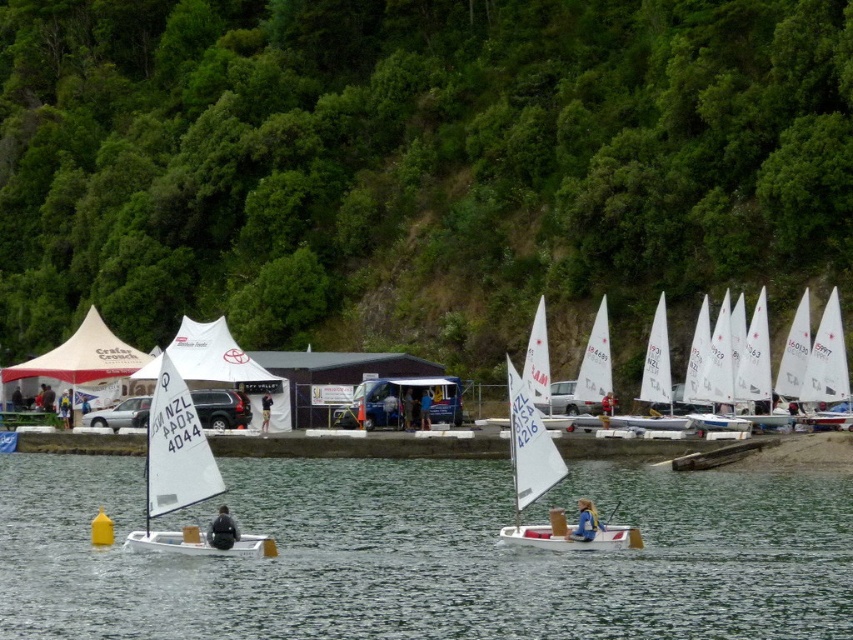
Question: Which object appears closest to the camera in this image?

Choices:
 (A) white sailboat at center
 (B) white matte sailboat at left

Answer: (A)

Question: Does black fabric jacket at lower center appear over dark blue fabric shirt at center?

Choices:
 (A) no
 (B) yes

Answer: (A)

Question: Is the position of green leafy hillside at upper center less distant than that of dark blue fabric shirt at center?

Choices:
 (A) no
 (B) yes

Answer: (B)

Question: Considering the real-world distances, which object is closest to the white sailboat at center?

Choices:
 (A) white matte sailboat at left
 (B) white matte sailboat at center

Answer: (B)

Question: Based on their relative distances, which object is farther from the black fabric jacket at lower center?

Choices:
 (A) white matte sailboat at left
 (B) white matte sailboat at center
 (C) dark blue fabric shirt at center
 (D) red fabric person at center

Answer: (C)

Question: Can you confirm if black fabric jacket at lower center is positioned above dark blue fabric pants at center?

Choices:
 (A) no
 (B) yes

Answer: (A)